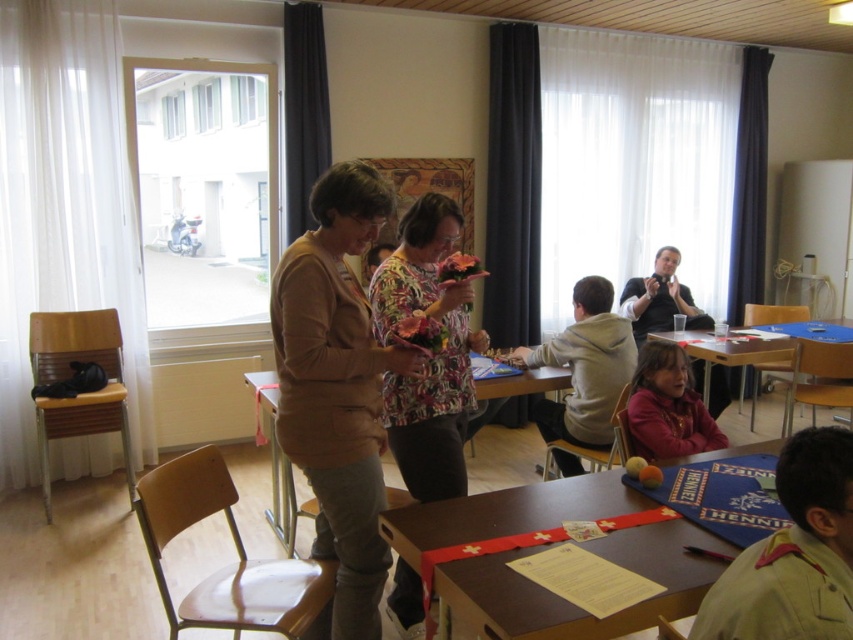
Can you confirm if matte brown jacket at center is bigger than blue fabric table at lower center?

Actually, matte brown jacket at center might be smaller than blue fabric table at lower center.

I want to click on matte brown jacket at center, so click(x=337, y=390).

Who is more distant from viewer, (375, 401) or (705, 353)?

The point (705, 353) is more distant.

Identify the location of matte brown jacket at center. The height and width of the screenshot is (640, 853). (337, 390).

At what (x,y) coordinates should I click in order to perform the action: click on brown wooden table at center. Please return your answer as a coordinate pair (x, y). Looking at the image, I should click on (283, 499).

Can you confirm if brown wooden table at center is wider than blue fabric table at lower center?

Incorrect, brown wooden table at center's width does not surpass blue fabric table at lower center's.

Does point (276, 385) lie in front of point (706, 364)?

Yes, point (276, 385) is closer to viewer.

Identify the location of brown wooden table at center. (283, 499).

Who is lower down, matte brown jacket at center or wooden table at lower center?

Positioned lower is wooden table at lower center.

Who is more forward, (338, 349) or (630, 532)?

Point (630, 532)

Where is `matte brown jacket at center`? matte brown jacket at center is located at coordinates (337, 390).